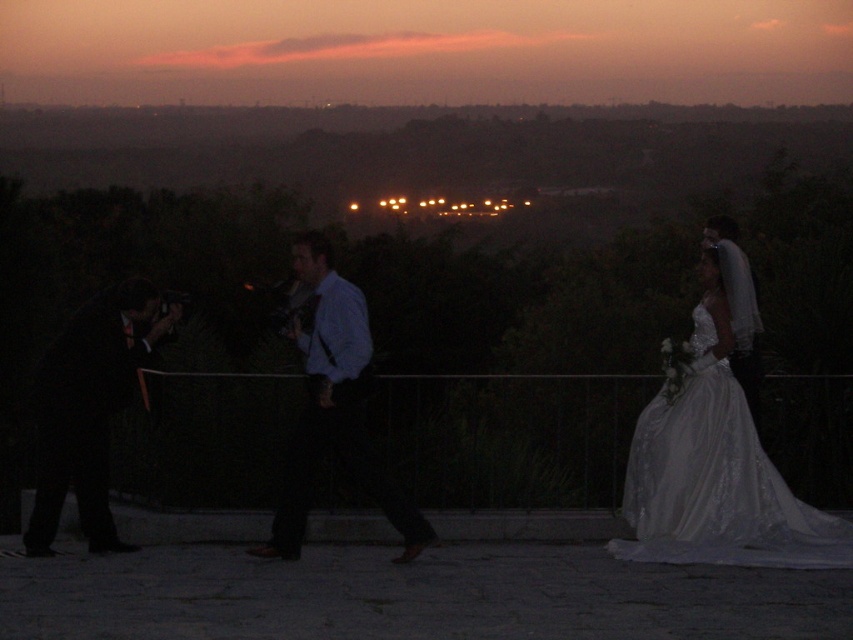
Question: Can you confirm if black suit at left is wider than white satin suit at right?

Choices:
 (A) yes
 (B) no

Answer: (A)

Question: Which object is positioned farthest from the black suit at left?

Choices:
 (A) white satin suit at right
 (B) blue shirt at center
 (C) white satin dress at right

Answer: (A)

Question: Considering the real-world distances, which object is closest to the blue shirt at center?

Choices:
 (A) black suit at left
 (B) white satin dress at right
 (C) white satin suit at right

Answer: (A)

Question: Can you confirm if blue shirt at center is smaller than white satin suit at right?

Choices:
 (A) no
 (B) yes

Answer: (A)

Question: Is white satin dress at right further to the viewer compared to white satin suit at right?

Choices:
 (A) yes
 (B) no

Answer: (B)

Question: Which object is positioned closest to the blue shirt at center?

Choices:
 (A) white satin suit at right
 (B) black suit at left

Answer: (B)